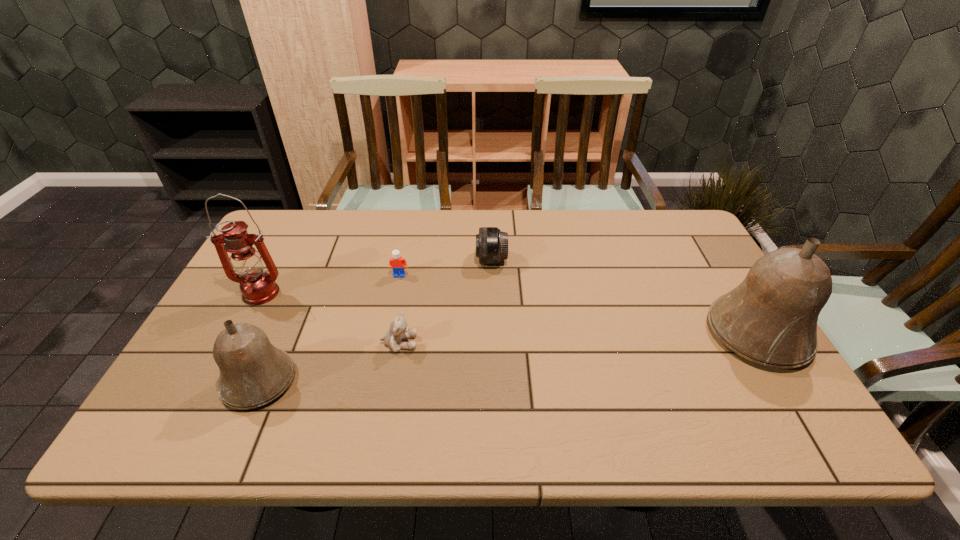
What are the coordinates of `the shorter bell` in the screenshot? It's located at (253, 372).

Find the location of a particular element. the third tallest object is located at coordinates (253, 372).

In order to click on the right bell in this screenshot , I will do `click(770, 318)`.

The height and width of the screenshot is (540, 960). I want to click on the rightmost object, so click(770, 318).

Locate an element on the screen. Image resolution: width=960 pixels, height=540 pixels. the farthest object is located at coordinates (491, 243).

The height and width of the screenshot is (540, 960). I want to click on the fifth object from left to right, so click(x=491, y=243).

Find the location of a particular element. This screenshot has height=540, width=960. the fifth nearest object is located at coordinates (397, 263).

What are the coordinates of `teddy bear` in the screenshot? It's located at (398, 330).

Identify the location of oil lamp. (258, 287).

The width and height of the screenshot is (960, 540). In order to click on vacant area situated on the right of the shorter bell in this screenshot , I will do `click(428, 381)`.